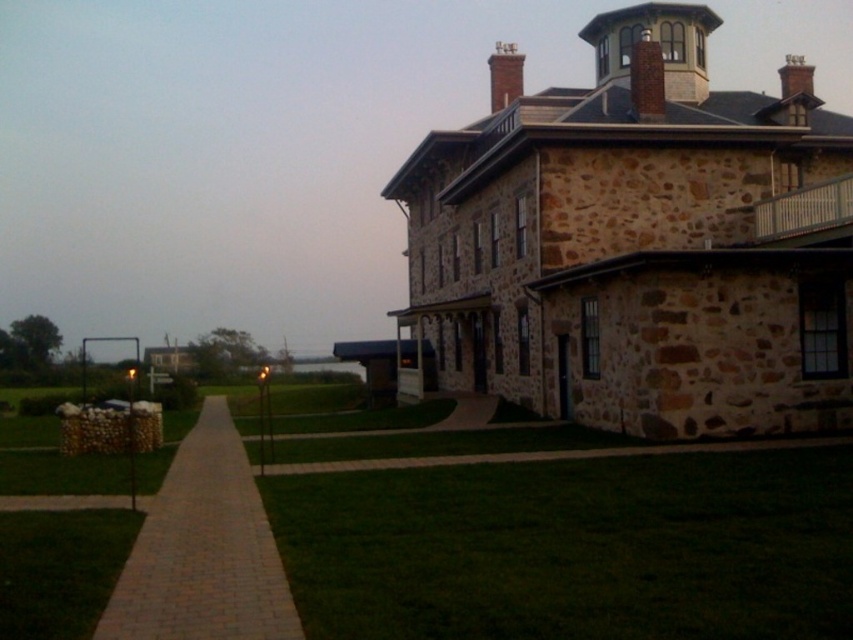
You are standing at the entrance of the building and want to take a photo of the brown stone tower at upper right. If your camera can focus on objects up to 15 meters away, will you be able to capture a clear image of the tower?

The brown stone tower at upper right is 16.53 meters from camera, which is beyond the camera focus range of 15 meters. Therefore, the camera cannot capture a clear image of the tower.

You are a gardener who needs to place a 3.5 meter long decorative fence between the brick paved path at lower left and the green grass at lower left. Is there enough space to place the fence without overlapping either the path or the grass?

The distance between the brick paved path at lower left and the green grass at lower left is 4.17 meters. Since the fence is 3.5 meters long, it can be placed between them without overlapping either the path or the grass.

You are a delivery person carrying a heavy box and need to walk from the street to the entrance of the building. The brick paved path at lower left and the green grass at lower left are both options. Which surface is higher and would require less effort to step onto?

The brick paved path at lower left has a greater height compared to the green grass at lower left, so stepping onto the brick paved path at lower left would require less effort since it is already elevated.